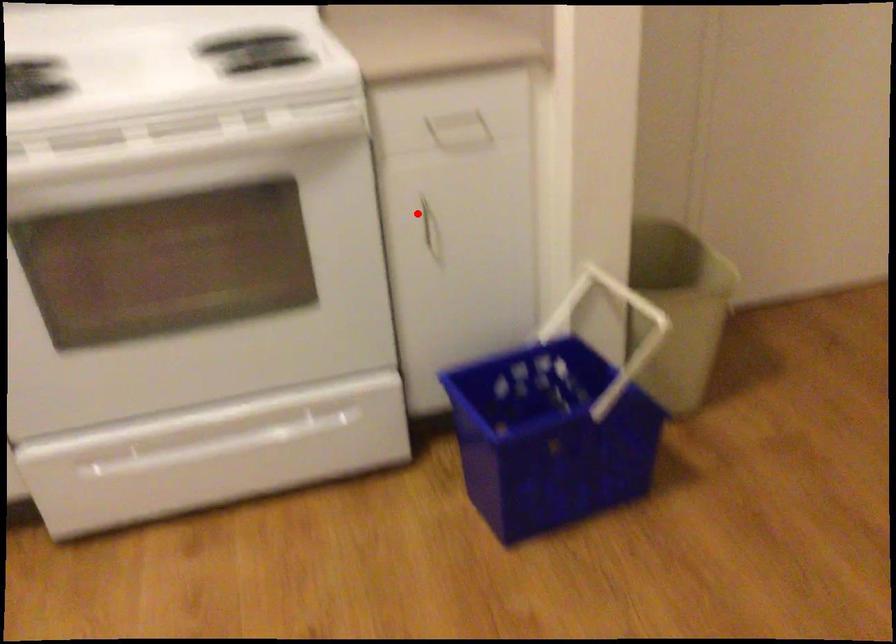
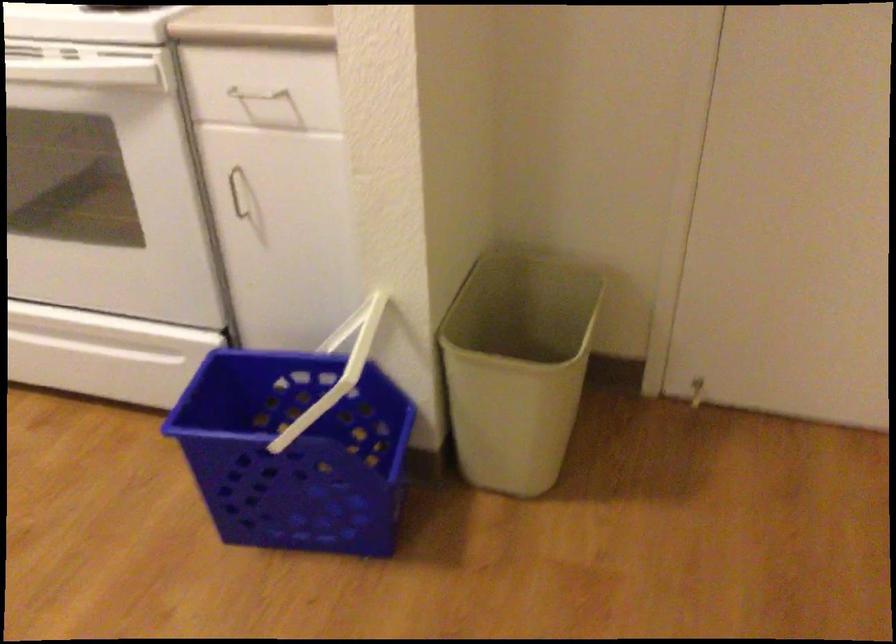
The point at the highlighted location is marked in the first image. Where is the corresponding point in the second image?

(237, 192)